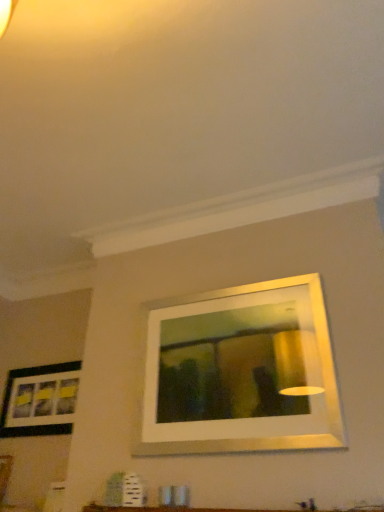
This screenshot has height=512, width=384. What do you see at coordinates (40, 400) in the screenshot?
I see `matte black picture frame at lower left` at bounding box center [40, 400].

The height and width of the screenshot is (512, 384). What are the coordinates of `matte black picture frame at lower left` in the screenshot? It's located at (40, 400).

Find the location of a particular element. matte black picture frame at lower left is located at coordinates (40, 400).